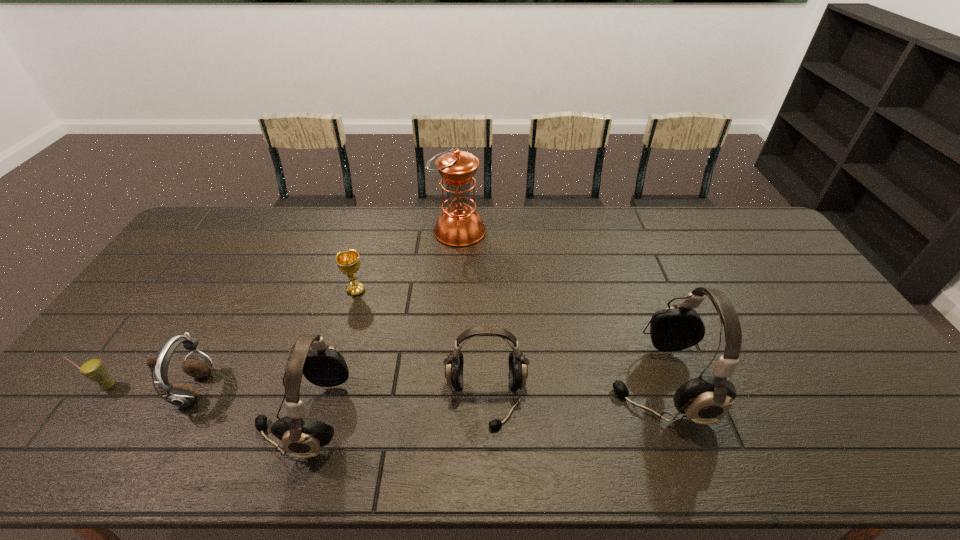
This screenshot has width=960, height=540. What are the coordinates of `the third tallest object` in the screenshot? It's located at (324, 366).

Identify the location of the leftmost headset. (324, 366).

Locate an element on the screen. the shortest headset is located at coordinates (518, 370).

Identify the location of the rightmost object. (706, 399).

Where is `the farthest object`? Image resolution: width=960 pixels, height=540 pixels. the farthest object is located at coordinates (459, 225).

The height and width of the screenshot is (540, 960). In order to click on the sixth nearest object in this screenshot , I will do `click(348, 262)`.

Locate an element on the screen. Image resolution: width=960 pixels, height=540 pixels. straw for drinking is located at coordinates (93, 369).

Identify the location of the sixth object from right to left. (179, 394).

Find the location of a particular element. This screenshot has height=540, width=960. free location located 0.080m with the microphone on the side of the leftmost headset is located at coordinates (228, 416).

Where is `vacant region located with the microphone on the side of the leftmost headset`? vacant region located with the microphone on the side of the leftmost headset is located at coordinates (194, 416).